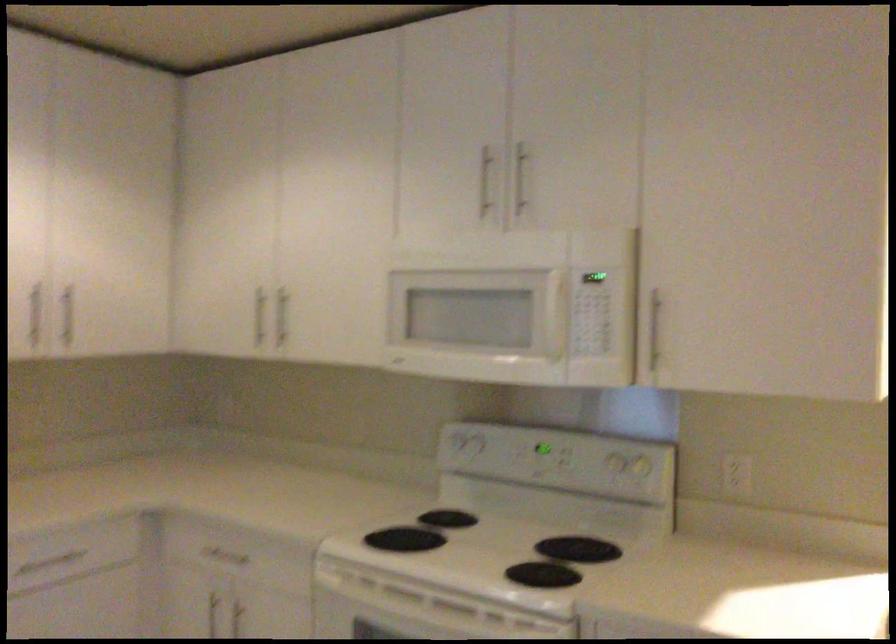
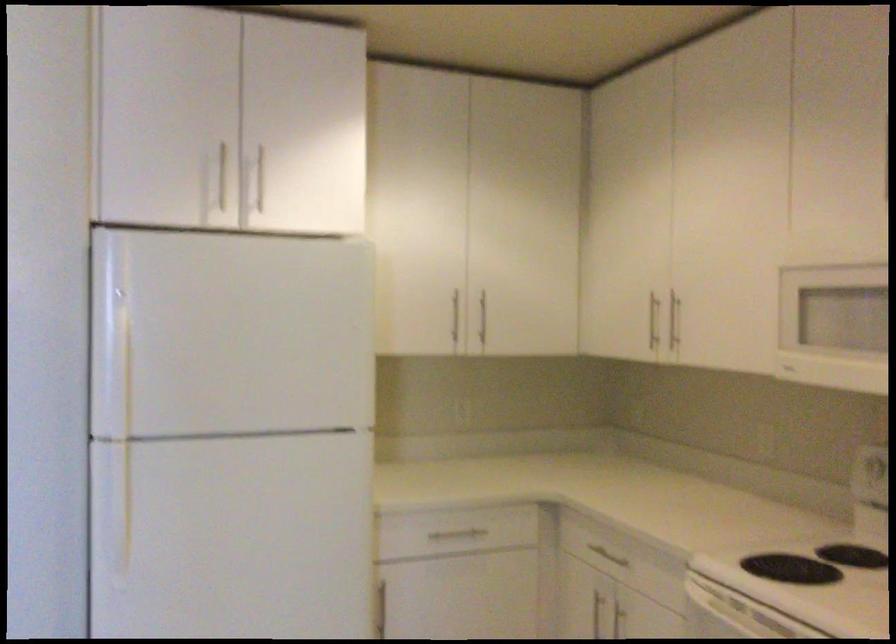
Locate, in the second image, the point that corresponds to (279,317) in the first image.

(673, 321)